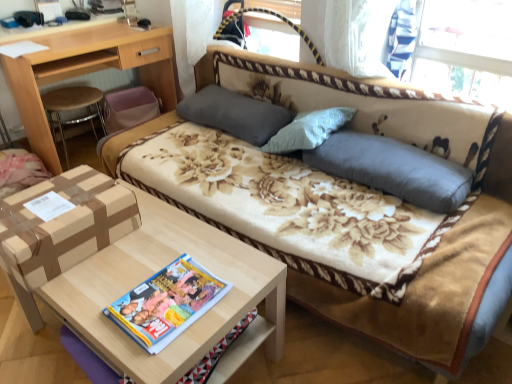
Where is `free area behind multicolored glossy magazine at center`? The height and width of the screenshot is (384, 512). free area behind multicolored glossy magazine at center is located at coordinates [x=174, y=250].